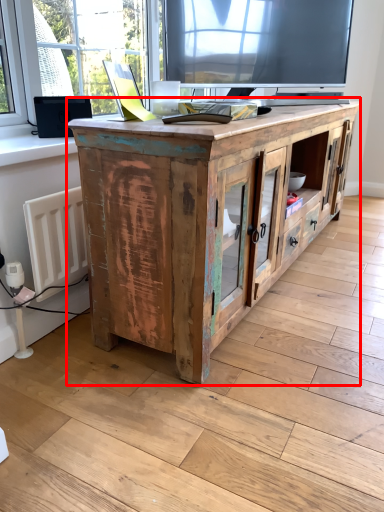
Question: From the image, what is the correct spatial relationship of cabinetry (annotated by the red box) in relation to window sill?

Choices:
 (A) left
 (B) right

Answer: (B)